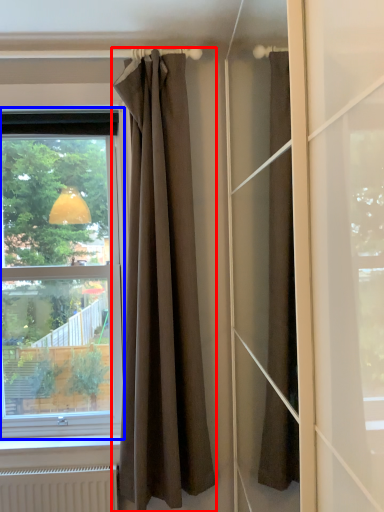
Question: Which of the following is the closest to the observer, curtain (highlighted by a red box) or window (highlighted by a blue box)?

Choices:
 (A) curtain
 (B) window

Answer: (A)